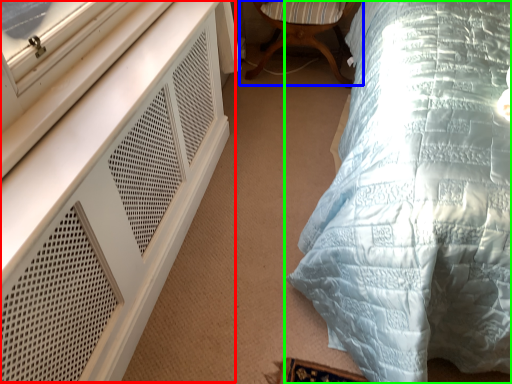
Question: Considering the real-world distances, which object is closest to dresser (highlighted by a red box)? chair (highlighted by a blue box) or bed (highlighted by a green box).

Choices:
 (A) chair
 (B) bed

Answer: (B)